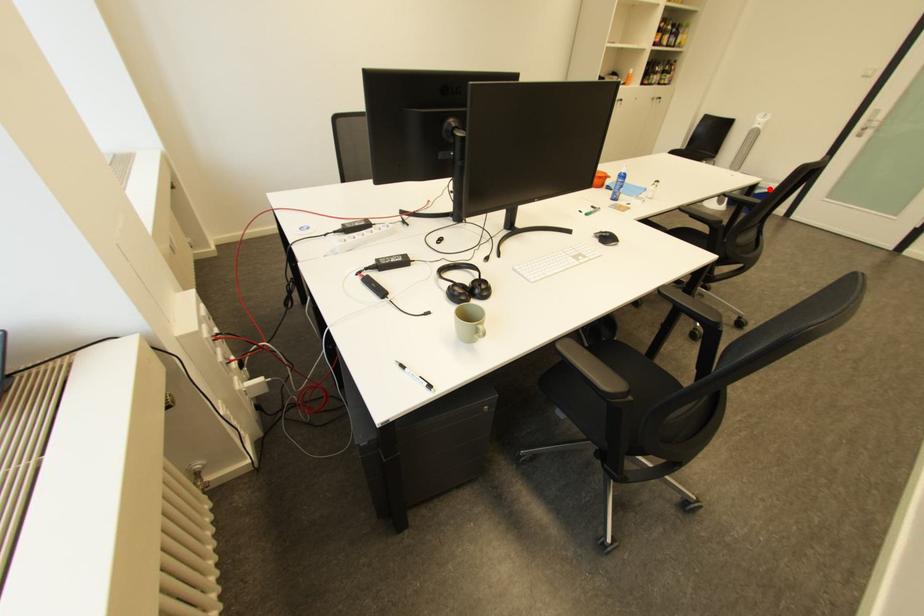
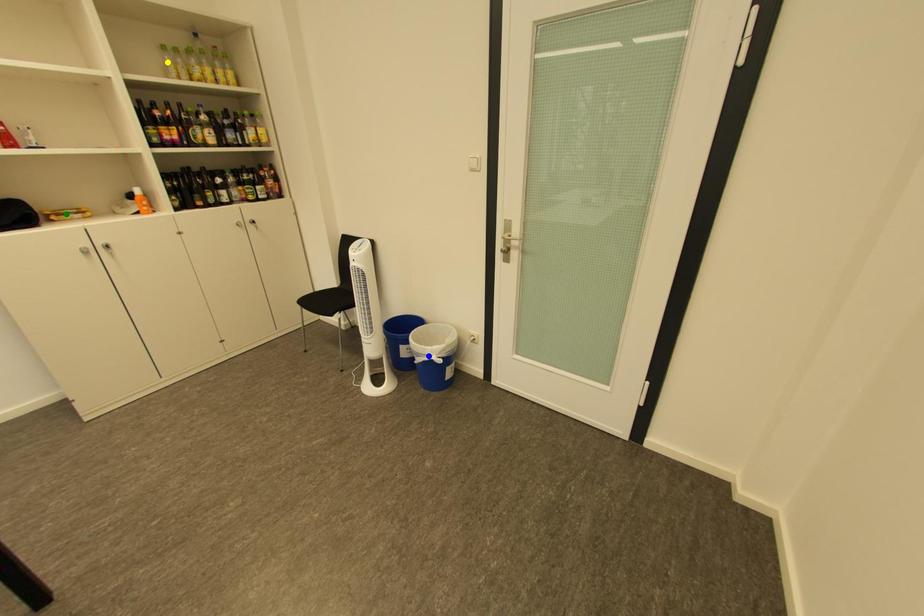
Question: I am providing you with two images of the same scene from different viewpoints. A red point is marked on the first image. You are given multiple points on the second image. Which spot in image 2 lines up with the point in image 1?

Choices:
 (A) blue point
 (B) green point
 (C) yellow point

Answer: (A)